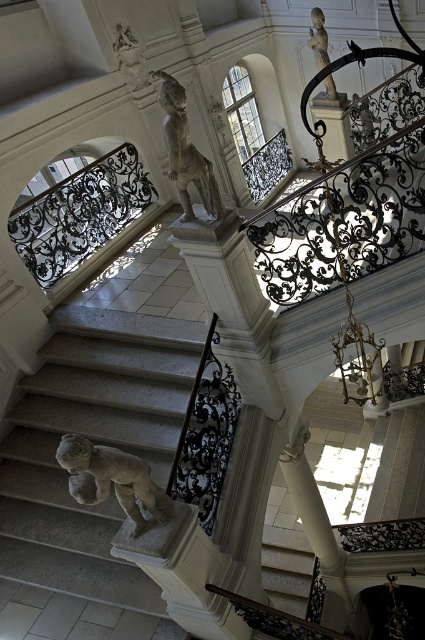
Question: Which of the following is the farthest from the observer?

Choices:
 (A) (136, 536)
 (B) (51, 378)
 (C) (204, 160)
 (D) (325, 65)

Answer: (D)

Question: Is the position of white stone statue at center less distant than that of white marble statue at upper center?

Choices:
 (A) no
 (B) yes

Answer: (B)

Question: Which point is closer to the camera taking this photo?

Choices:
 (A) (314, 52)
 (B) (209, 188)

Answer: (B)

Question: Considering the relative positions of white marble statue at center and matte white statue at upper center in the image provided, where is white marble statue at center located with respect to matte white statue at upper center?

Choices:
 (A) below
 (B) above

Answer: (A)

Question: Which object is positioned closest to the white marble statue at upper center?

Choices:
 (A) matte white statue at upper center
 (B) white marble statue at center

Answer: (A)

Question: Does white marble statue at center have a smaller size compared to matte white statue at upper center?

Choices:
 (A) no
 (B) yes

Answer: (A)